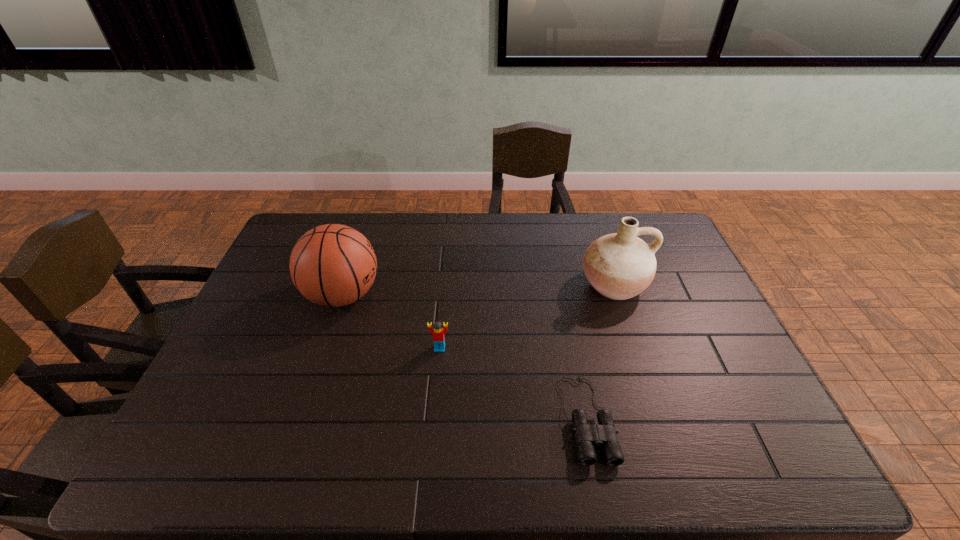
What are the coordinates of `unoccupied position between the shortest object and the pottery` in the screenshot? It's located at 600,351.

You are a GUI agent. You are given a task and a screenshot of the screen. Output one action in this format:
    pyautogui.click(x=<x>, y=<y>)
    Task: Click on the empty location between the leftmost object and the second object from left to right
    This screenshot has width=960, height=540.
    Given the screenshot: What is the action you would take?
    pyautogui.click(x=392, y=322)

Find the location of a particular element. Image resolution: width=960 pixels, height=540 pixels. empty location between the basketball and the second nearest object is located at coordinates (392, 322).

You are a GUI agent. You are given a task and a screenshot of the screen. Output one action in this format:
    pyautogui.click(x=<x>, y=<y>)
    Task: Click on the vacant space in between the pottery and the basketball
    This screenshot has width=960, height=540.
    Given the screenshot: What is the action you would take?
    pyautogui.click(x=478, y=290)

This screenshot has height=540, width=960. Identify the location of free point between the second nearest object and the rightmost object. (527, 316).

Select which object appears as the closest to the leftmost object. Please provide its 2D coordinates. Your answer should be formatted as a tuple, i.e. [(x, y)], where the tuple contains the x and y coordinates of a point satisfying the conditions above.

[(438, 333)]

Locate which object ranks in proximity to the binoculars. Please provide its 2D coordinates. Your answer should be formatted as a tuple, i.e. [(x, y)], where the tuple contains the x and y coordinates of a point satisfying the conditions above.

[(620, 265)]

The height and width of the screenshot is (540, 960). Find the location of `free space that satisfies the following two spatial constraints: 1. to pour from the handle of the rightmost object; 2. on the surface of the leftmost object near the brand logo`. free space that satisfies the following two spatial constraints: 1. to pour from the handle of the rightmost object; 2. on the surface of the leftmost object near the brand logo is located at coordinates (617, 295).

The width and height of the screenshot is (960, 540). I want to click on vacant position in the image that satisfies the following two spatial constraints: 1. to pour from the handle of the pottery; 2. on the surface of the basketball near the brand logo, so 617,295.

Identify the location of blank area in the image that satisfies the following two spatial constraints: 1. to pour from the handle of the pottery; 2. on the surface of the leftmost object near the brand logo. The width and height of the screenshot is (960, 540). (617, 295).